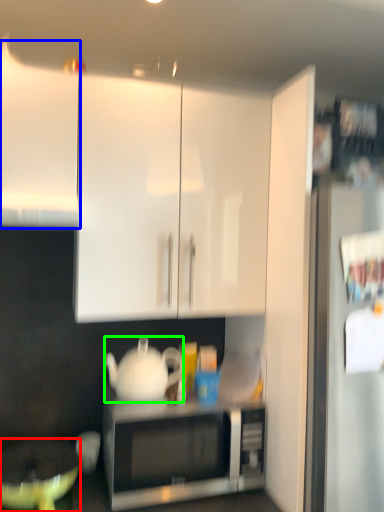
Question: Which is nearer to the mixing bowl (highlighted by a red box)? cabinetry (highlighted by a blue box) or teapot (highlighted by a green box).

Choices:
 (A) cabinetry
 (B) teapot

Answer: (B)